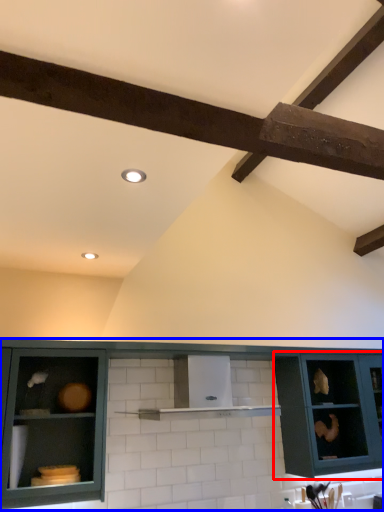
Question: Which of the following is the farthest to the observer, cabinetry (highlighted by a red box) or cabinetry (highlighted by a blue box)?

Choices:
 (A) cabinetry
 (B) cabinetry

Answer: (A)